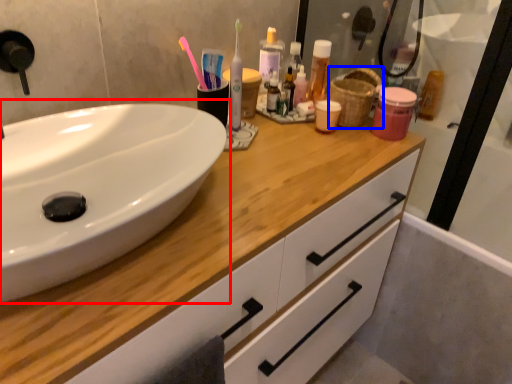
Question: Which of the following is the closest to the observer, sink (highlighted by a red box) or basket (highlighted by a blue box)?

Choices:
 (A) sink
 (B) basket

Answer: (A)